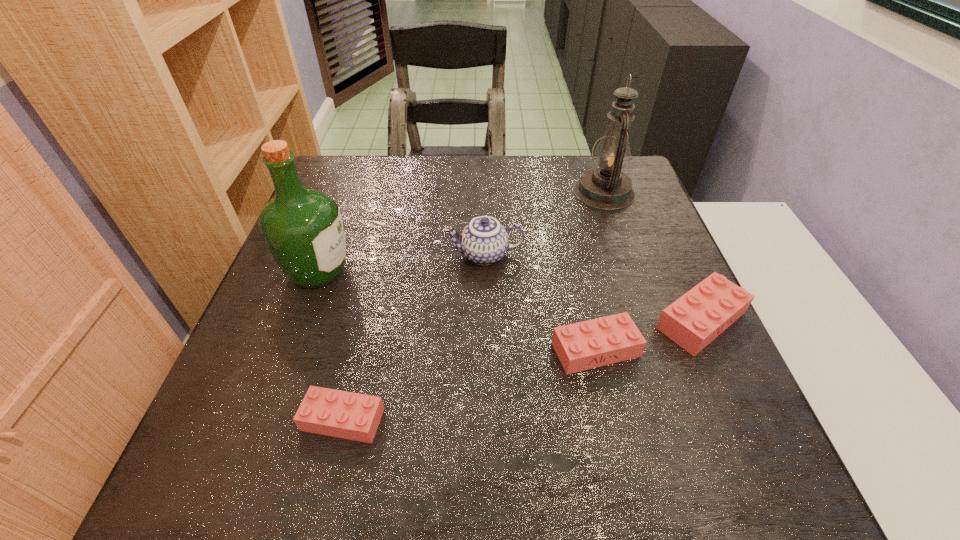
Identify the location of free region at the far right corner of the desktop. (588, 156).

I want to click on free space at the near right corner of the desktop, so click(751, 430).

At what (x,y) coordinates should I click in order to perform the action: click on free space between the rightmost Lego and the shortest object. Please return your answer as a coordinate pair (x, y). This screenshot has height=540, width=960. Looking at the image, I should click on (x=521, y=370).

Image resolution: width=960 pixels, height=540 pixels. In order to click on unoccupied position between the chinaware and the oil lamp in this screenshot , I will do `click(544, 224)`.

At what (x,y) coordinates should I click in order to perform the action: click on blank region between the liquor and the nearest object. Please return your answer as a coordinate pair (x, y). The height and width of the screenshot is (540, 960). Looking at the image, I should click on (331, 346).

Locate an element on the screen. vacant space that's between the fourth shortest object and the liquor is located at coordinates (401, 264).

The image size is (960, 540). What are the coordinates of `vacant area that lies between the fourth shortest object and the oil lamp` in the screenshot? It's located at (544, 224).

Where is `vacant area that lies between the rightmost Lego and the fourth shortest object`? vacant area that lies between the rightmost Lego and the fourth shortest object is located at coordinates (592, 288).

Identify the location of vacant region between the oil lamp and the liquor. (461, 232).

This screenshot has height=540, width=960. Identify the location of empty space that is in between the second Lego from right to left and the fourth shortest object. (540, 302).